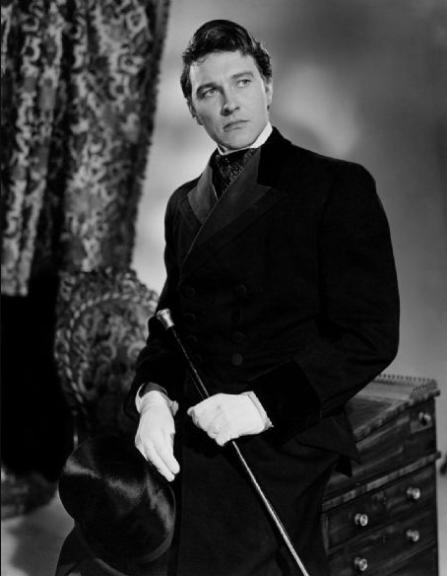
Find the location of `chair`. chair is located at coordinates (110, 342).